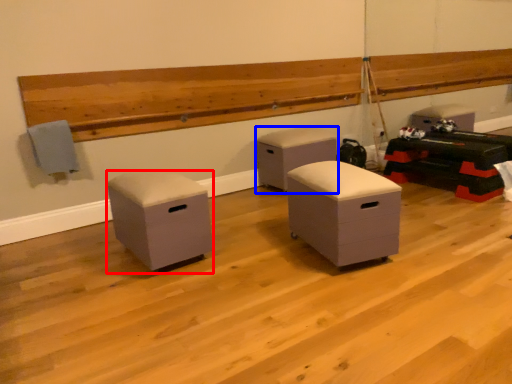
Question: Among these objects, which one is nearest to the camera, furniture (highlighted by a red box) or furniture (highlighted by a blue box)?

Choices:
 (A) furniture
 (B) furniture

Answer: (A)